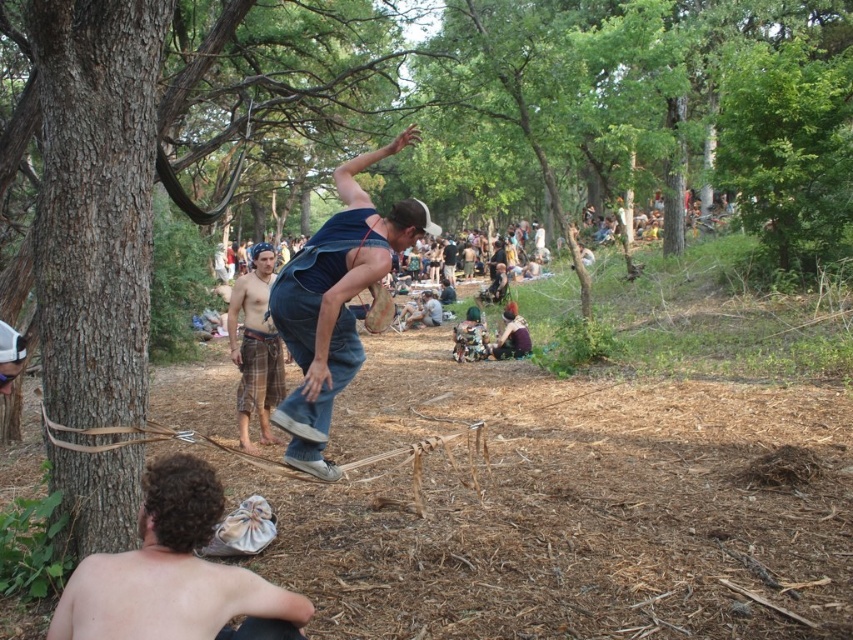
You are a photographer trying to capture a photo of the brown rough tree trunk at left and the denim overalls at center. If your camera can only focus on objects within 36 inches, will both subjects be in focus?

The distance between the brown rough tree trunk at left and denim overalls at center is 36.90 inches, which exceeds the camera focus range of 36 inches. Thus, both subjects cannot be in focus simultaneously.